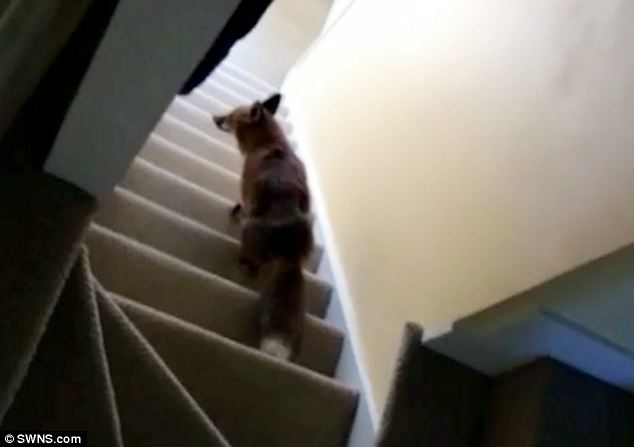
Locate an element on the screen. floor is located at coordinates (285, 27).